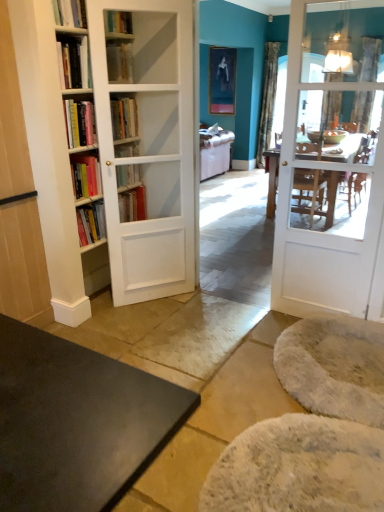
The width and height of the screenshot is (384, 512). Identify the location of white fluffy yoga mat at lower right, the second yoga mat positioned from the front. (334, 367).

In order to face matte black portrait at upper center, should I rotate leftwards or rightwards?

Rotate your view right by about 4.528°.

What is the approximate width of matte black portrait at upper center?

matte black portrait at upper center is 3.18 inches in width.

Describe the element at coordinates (120, 62) in the screenshot. Image resolution: width=384 pixels, height=512 pixels. I see `hardcover book at upper center` at that location.

This screenshot has width=384, height=512. Identify the location of gray fuzzy yoga mat at lower right, which is the 1th yoga mat in front-to-back order. (299, 467).

Locate an element on the screen. The height and width of the screenshot is (512, 384). metallic glass lampshade at upper right is located at coordinates (339, 47).

Is silky teal curtain at upper right looking in the opposite direction of white fluffy yoga mat at lower right, positioned as the 1th yoga mat in back-to-front order?

No, silky teal curtain at upper right is not facing away from white fluffy yoga mat at lower right, positioned as the 1th yoga mat in back-to-front order.

The height and width of the screenshot is (512, 384). What are the coordinates of `the 1st yoga mat positioned below the silky teal curtain at upper right (from the image's perspective)` in the screenshot? It's located at [334, 367].

Which is closer to the camera, (265, 102) or (333, 353)?

Point (265, 102) appears to be farther away from the viewer than point (333, 353).

Is gray fuzzy yoga mat at lower right, which is the 1th yoga mat in front-to-back order, at the back of white fluffy yoga mat at lower right, the second yoga mat positioned from the front?

That's not correct — white fluffy yoga mat at lower right, the second yoga mat positioned from the front, is not looking away from gray fuzzy yoga mat at lower right, which is the 1th yoga mat in front-to-back order.

Between white fluffy yoga mat at lower right, the second yoga mat positioned from the front, and gray fuzzy yoga mat at lower right, which appears as the 2th yoga mat when viewed from the back, which one has smaller width?

Thinner between the two is gray fuzzy yoga mat at lower right, which appears as the 2th yoga mat when viewed from the back.

Does white fluffy yoga mat at lower right, the second yoga mat positioned from the front, have a larger size compared to gray fuzzy yoga mat at lower right, which appears as the 2th yoga mat when viewed from the back?

Yes, white fluffy yoga mat at lower right, the second yoga mat positioned from the front, is bigger than gray fuzzy yoga mat at lower right, which appears as the 2th yoga mat when viewed from the back.

From a real-world perspective, between white fluffy yoga mat at lower right, the second yoga mat positioned from the front, and gray fuzzy yoga mat at lower right, which appears as the 2th yoga mat when viewed from the back, who is vertically lower?

In real-world perspective, gray fuzzy yoga mat at lower right, which appears as the 2th yoga mat when viewed from the back, is lower.

How much distance is there between white fluffy yoga mat at lower right, positioned as the 1th yoga mat in back-to-front order, and metallic glass lampshade at upper right?

They are 13.51 feet apart.

Between white fluffy yoga mat at lower right, positioned as the 1th yoga mat in back-to-front order, and metallic glass lampshade at upper right, which one has less height?

white fluffy yoga mat at lower right, positioned as the 1th yoga mat in back-to-front order, is shorter.

Considering the positions of point (285, 378) and point (349, 71), is point (285, 378) closer or farther from the camera than point (349, 71)?

Point (285, 378).

From a real-world perspective, is white fluffy yoga mat at lower right, the second yoga mat positioned from the front, above or below metallic glass lampshade at upper right?

white fluffy yoga mat at lower right, the second yoga mat positioned from the front, is situated lower than metallic glass lampshade at upper right in the real world.

Does hardcover book at upper center come behind metallic glass lampshade at upper right?

No, it is in front of metallic glass lampshade at upper right.

Looking at their sizes, would you say hardcover book at upper center is wider or thinner than metallic glass lampshade at upper right?

Considering their sizes, hardcover book at upper center looks slimmer than metallic glass lampshade at upper right.

Does point (131, 63) appear closer or farther from the camera than point (349, 61)?

Point (131, 63) is closer to the camera than point (349, 61).

Are hardcover book at upper center and metallic glass lampshade at upper right beside each other?

No, hardcover book at upper center is not in contact with metallic glass lampshade at upper right.

From the picture: Do you think hardcover book at upper center is within suede-like gray couch at center, or outside of it?

hardcover book at upper center is not enclosed by suede-like gray couch at center.

Which is less distant, (128,80) or (206,174)?

Point (128,80) is positioned closer to the camera compared to point (206,174).

The height and width of the screenshot is (512, 384). I want to click on book that is in front of the suede-like gray couch at center, so click(120, 62).

Does hardcover book at upper center appear on the left side of matte black portrait at upper center?

Yes, hardcover book at upper center is to the left of matte black portrait at upper center.

Looking at this image, from a real-world perspective, who is located lower, hardcover book at upper center or matte black portrait at upper center?

matte black portrait at upper center is physically lower.

Considering the sizes of objects hardcover book at upper center and matte black portrait at upper center in the image provided, who is wider, hardcover book at upper center or matte black portrait at upper center?

hardcover book at upper center is wider.

Considering the relative sizes of hardcover book at upper center and matte black portrait at upper center in the image provided, is hardcover book at upper center taller than matte black portrait at upper center?

No, hardcover book at upper center is not taller than matte black portrait at upper center.

In the scene shown: Can you confirm if metallic glass lampshade at upper right is smaller than white fluffy yoga mat at lower right, the second yoga mat positioned from the front?

Indeed, metallic glass lampshade at upper right has a smaller size compared to white fluffy yoga mat at lower right, the second yoga mat positioned from the front.

From a real-world perspective, is metallic glass lampshade at upper right above or below white fluffy yoga mat at lower right, the second yoga mat positioned from the front?

From a real-world perspective, metallic glass lampshade at upper right is physically above white fluffy yoga mat at lower right, the second yoga mat positioned from the front.

From the image's perspective, which one is positioned higher, metallic glass lampshade at upper right or white fluffy yoga mat at lower right, positioned as the 1th yoga mat in back-to-front order?

metallic glass lampshade at upper right.

Where is `the 1st yoga mat located beneath the silky teal curtain at upper right (from a real-world perspective)`? The width and height of the screenshot is (384, 512). the 1st yoga mat located beneath the silky teal curtain at upper right (from a real-world perspective) is located at coordinates (334, 367).

Where is `yoga mat located on the right of gray fuzzy yoga mat at lower right, which appears as the 2th yoga mat when viewed from the back`? yoga mat located on the right of gray fuzzy yoga mat at lower right, which appears as the 2th yoga mat when viewed from the back is located at coordinates (334, 367).

Estimate the real-world distances between objects in this image. Which object is closer to silky teal curtain at upper right, white wooden door at right or suede-like gray couch at center?

Among the two, suede-like gray couch at center is located nearer to silky teal curtain at upper right.

From the image, which object appears to be nearer to matte black portrait at upper center, suede-like gray couch at center or gray fuzzy yoga mat at lower right, which is the 1th yoga mat in front-to-back order?

suede-like gray couch at center is closer to matte black portrait at upper center.

Consider the image. Based on their spatial positions, is gray fuzzy yoga mat at lower right, which appears as the 2th yoga mat when viewed from the back, or white wooden door at right further from hardcover book at upper center?

white wooden door at right.

Which object lies further to the anchor point suede-like gray couch at center, white glossy bookcase at left or matte black portrait at upper center?

white glossy bookcase at left is further to suede-like gray couch at center.

Considering their positions, is metallic glass lampshade at upper right positioned closer to suede-like gray couch at center than silky teal curtain at upper right?

silky teal curtain at upper right is positioned closer to the anchor suede-like gray couch at center.

Looking at this image, considering their positions, is silky teal curtain at upper right positioned closer to matte black portrait at upper center than white fluffy yoga mat at lower right, positioned as the 1th yoga mat in back-to-front order?

silky teal curtain at upper right is positioned closer to the anchor matte black portrait at upper center.

When comparing their distances from matte black portrait at upper center, does hardcover book at upper center or light brown wood cabinet at left seem closer?

hardcover book at upper center is closer to matte black portrait at upper center.

Looking at the image, which one is located further to silky teal curtain at upper right, white wooden door at right or light brown wood cabinet at left?

The object further to silky teal curtain at upper right is light brown wood cabinet at left.

Image resolution: width=384 pixels, height=512 pixels. I want to click on studio couch between hardcover book at upper center and matte black portrait at upper center in the front-back direction, so click(215, 153).

This screenshot has width=384, height=512. What are the coordinates of `book between metallic glass lampshade at upper right and gray fuzzy yoga mat at lower right, which appears as the 2th yoga mat when viewed from the back, in the vertical direction` in the screenshot? It's located at (120, 62).

Identify the location of yoga mat that lies between metallic glass lampshade at upper right and gray fuzzy yoga mat at lower right, which is the 1th yoga mat in front-to-back order, from top to bottom. (334, 367).

What are the coordinates of `bookcase located between white fluffy yoga mat at lower right, positioned as the 1th yoga mat in back-to-front order, and suede-like gray couch at center in the depth direction` in the screenshot? It's located at (146, 145).